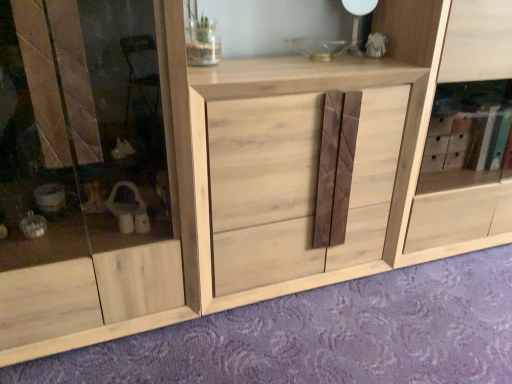
Question: Considering the positions of natural wood cabinet at center and natural wood cabinet at center in the image, is natural wood cabinet at center taller or shorter than natural wood cabinet at center?

Choices:
 (A) tall
 (B) short

Answer: (A)

Question: Based on their sizes in the image, would you say natural wood cabinet at center is bigger or smaller than natural wood cabinet at center?

Choices:
 (A) small
 (B) big

Answer: (A)

Question: Estimate the real-world distances between objects in this image. Which object is farther from the natural wood drawer at center?

Choices:
 (A) natural wood cabinet at center
 (B) natural wood cabinet at center

Answer: (B)

Question: Which of these objects is positioned farthest from the natural wood cabinet at center?

Choices:
 (A) natural wood cabinet at center
 (B) natural wood drawer at center

Answer: (A)